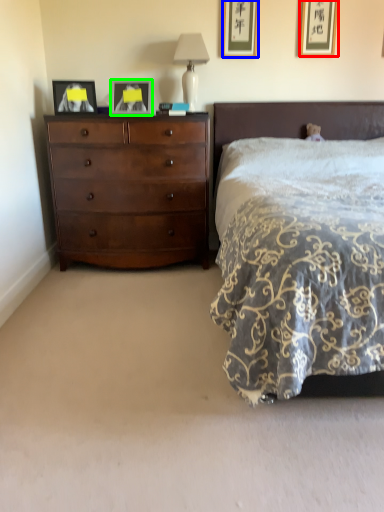
Question: Which is nearer to the picture frame (highlighted by a red box)? picture frame (highlighted by a blue box) or picture frame (highlighted by a green box).

Choices:
 (A) picture frame
 (B) picture frame

Answer: (A)